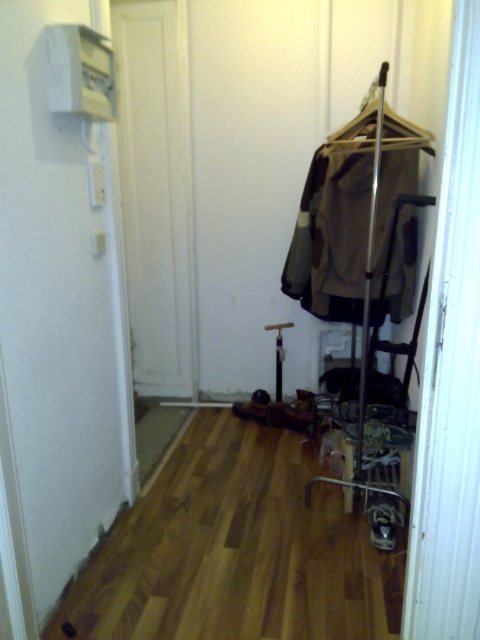
Does natural wood floor at lower center have a larger size compared to matte brown coat rack at center?

Correct, natural wood floor at lower center is larger in size than matte brown coat rack at center.

Which of these two, natural wood floor at lower center or matte brown coat rack at center, stands taller?

matte brown coat rack at center is taller.

Between point (136, 525) and point (394, 188), which one is positioned in front?

Point (136, 525) is in front.

Where is `natural wood floor at lower center`? This screenshot has height=640, width=480. natural wood floor at lower center is located at coordinates (236, 550).

Is point (322, 280) closer to viewer compared to point (348, 140)?

No.

Can you confirm if matte brown coat rack at center is bigger than metallic silver hanger at upper center?

No.

Who is more forward, (x=375, y=262) or (x=376, y=88)?

Positioned in front is point (x=375, y=262).

Image resolution: width=480 pixels, height=640 pixels. In order to click on matte brown coat rack at center in this screenshot , I will do `click(332, 236)`.

From the picture: Is brown fabric coat at center shorter than matte brown coat rack at center?

No, brown fabric coat at center is not shorter than matte brown coat rack at center.

Between brown fabric coat at center and matte brown coat rack at center, which one is positioned lower?

brown fabric coat at center is below.

Does point (384, 160) lie behind point (352, 291)?

No, (384, 160) is in front of (352, 291).

At what (x,y) coordinates should I click in order to perform the action: click on brown fabric coat at center. Please return your answer as a coordinate pair (x, y). The width and height of the screenshot is (480, 640). Looking at the image, I should click on (360, 230).